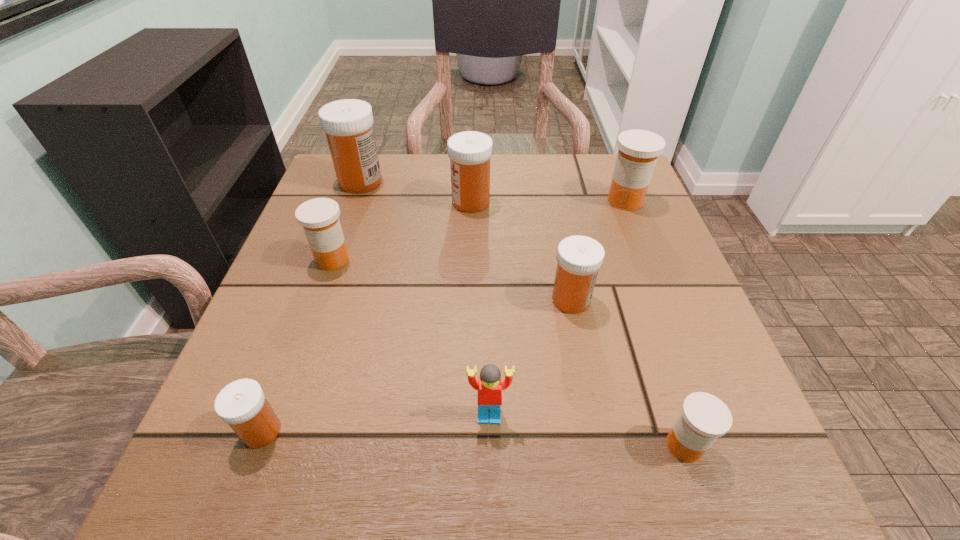
The height and width of the screenshot is (540, 960). What are the coordinates of `the smallest orange medicine` in the screenshot? It's located at (704, 417).

Where is `the nearest white medicine`? The image size is (960, 540). the nearest white medicine is located at coordinates (x=242, y=404).

In order to click on blank area located 0.340m on the right of the tallest object in this screenshot , I will do `click(524, 182)`.

You are a GUI agent. You are given a task and a screenshot of the screen. Output one action in this format:
    pyautogui.click(x=<x>, y=<y>)
    Task: Click on the vacant space located on the label of the farthest orange medicine
    The image size is (960, 540).
    Given the screenshot: What is the action you would take?
    pyautogui.click(x=681, y=340)

Locate an element on the screen. The height and width of the screenshot is (540, 960). vacant region located on the front of the third white medicine from left to right is located at coordinates (469, 271).

The image size is (960, 540). I want to click on free spot located on the label of the second biggest orange medicine, so click(x=298, y=361).

At what (x,y) coordinates should I click in order to perform the action: click on vacant space located 0.300m on the front of the third farthest white medicine. Please return your answer as a coordinate pair (x, y). Looking at the image, I should click on (610, 498).

Find the location of a particular element. The image size is (960, 540). vacant space located on the face of the Lego is located at coordinates (491, 475).

Locate an element on the screen. The width and height of the screenshot is (960, 540). free location located 0.050m on the label of the nearest orange medicine is located at coordinates (628, 445).

The height and width of the screenshot is (540, 960). What are the coordinates of `free space located 0.400m on the label of the nearest orange medicine` in the screenshot? It's located at (372, 445).